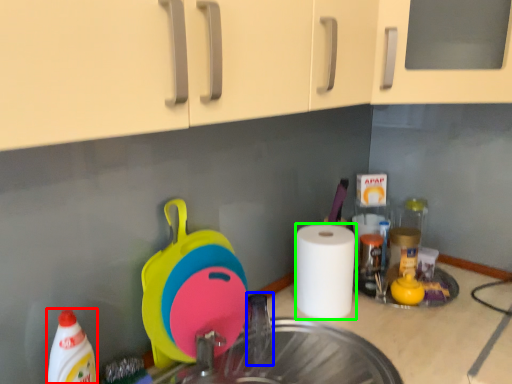
Question: Considering the real-world distances, which object is farthest from cleaning product (highlighted by a red box)? faucet (highlighted by a blue box) or paper towel (highlighted by a green box)?

Choices:
 (A) faucet
 (B) paper towel

Answer: (B)